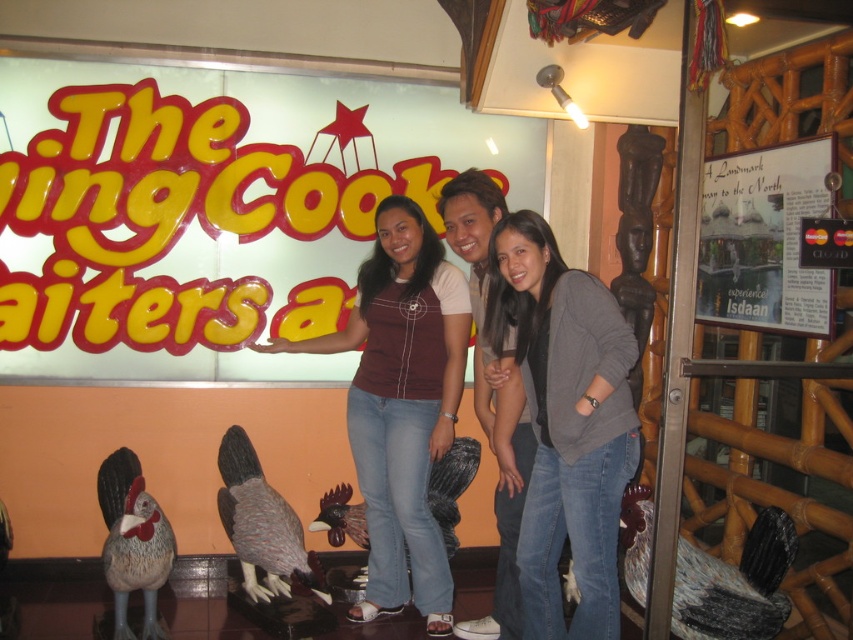
Does gray matte sweater at center appear under maroon fabric shirt at center?

Yes, gray matte sweater at center is below maroon fabric shirt at center.

Which of these two, gray matte sweater at center or maroon fabric shirt at center, stands shorter?

gray matte sweater at center

Which is behind, point (558, 556) or point (360, 323)?

Point (360, 323)

You are a GUI agent. You are given a task and a screenshot of the screen. Output one action in this format:
    pyautogui.click(x=<x>, y=<y>)
    Task: Click on the gray matte sweater at center
    This screenshot has width=853, height=640.
    Given the screenshot: What is the action you would take?
    pyautogui.click(x=561, y=422)

Which is more to the right, white paper sign at upper right or matte gray rooster at center?

white paper sign at upper right

Is point (724, 200) positioned after point (506, 609)?

That is True.

Is point (825, 282) positioned after point (508, 605)?

No, it is in front of (508, 605).

I want to click on white paper sign at upper right, so click(x=764, y=237).

Does point (547, 230) come farther from viewer compared to point (801, 330)?

No.

Who is more forward, (x=502, y=408) or (x=811, y=289)?

Point (x=502, y=408)

The image size is (853, 640). What are the coordinates of `gray matte sweater at center` in the screenshot? It's located at (561, 422).